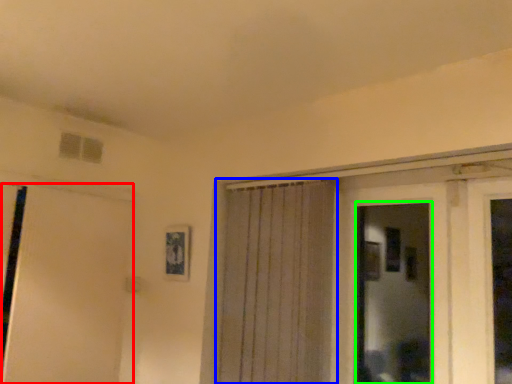
Question: Based on their relative distances, which object is nearer to door (highlighted by a red box)? Choose from curtain (highlighted by a blue box) and bay window (highlighted by a green box).

Choices:
 (A) curtain
 (B) bay window

Answer: (A)